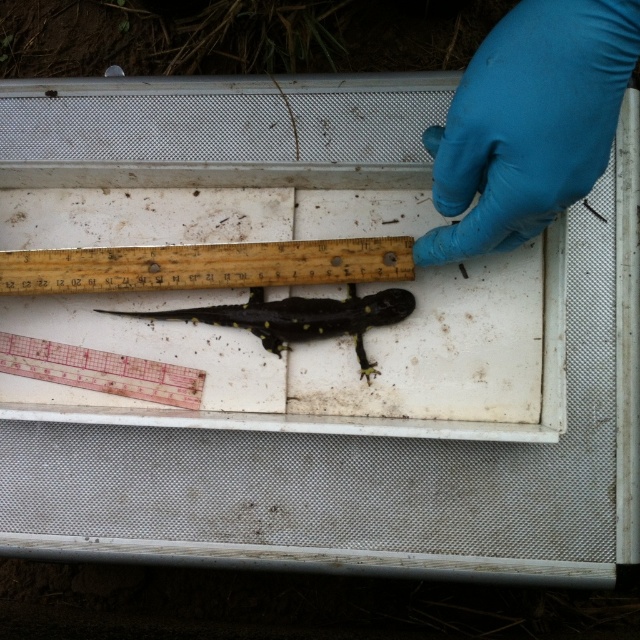
You are a researcher measuring a salamander and need to use the ruler closest to the tray edge. Which ruler should you choose between the wooden ruler at center and the transparent plastic ruler at lower left?

The transparent plastic ruler at lower left is closer to the tray edge, so you should use the transparent plastic ruler at lower left.

Based on the photo, you are a researcher measuring a salamander and need to choose a ruler that is wider. Which one should you pick between the wooden ruler at center and the transparent plastic ruler at lower left?

The wooden ruler at center is wider than the transparent plastic ruler at lower left, so you should pick the wooden ruler at center.

You are a researcher observing the salamander in the image. You notice the blue rubber glove at upper right and the black matte salamander at center. Which object is taller?

The blue rubber glove at upper right is taller than the black matte salamander at center.